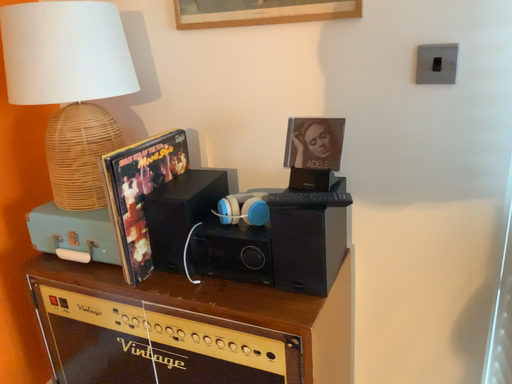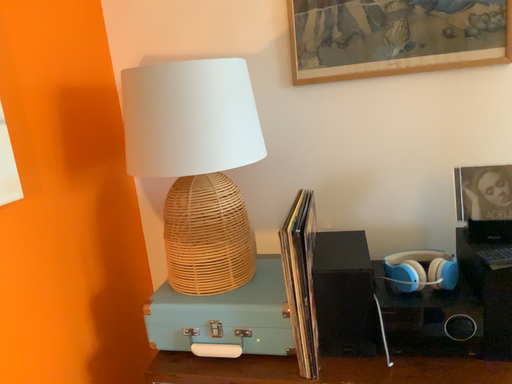
Question: Which way did the camera rotate in the video?

Choices:
 (A) rotated left
 (B) rotated right

Answer: (B)